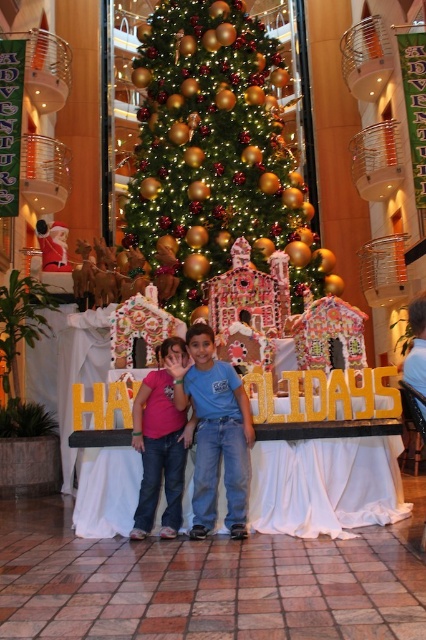
Question: Does green shiny christmas tree at center appear over pink fabric shirt at center?

Choices:
 (A) yes
 (B) no

Answer: (A)

Question: Which object is the farthest from the pink fabric dress at center?

Choices:
 (A) pink fabric shirt at center
 (B) green shiny christmas tree at center

Answer: (B)

Question: Can you confirm if green shiny christmas tree at center is positioned above pink fabric shirt at center?

Choices:
 (A) no
 (B) yes

Answer: (B)

Question: Which of the following is the farthest from the observer?

Choices:
 (A) pink fabric shirt at center
 (B) green shiny christmas tree at center
 (C) pink fabric dress at center

Answer: (B)

Question: Does green shiny christmas tree at center have a greater width compared to pink fabric dress at center?

Choices:
 (A) yes
 (B) no

Answer: (A)

Question: Which point appears farthest from the camera in this image?

Choices:
 (A) (160, 163)
 (B) (135, 531)
 (C) (198, 440)

Answer: (A)